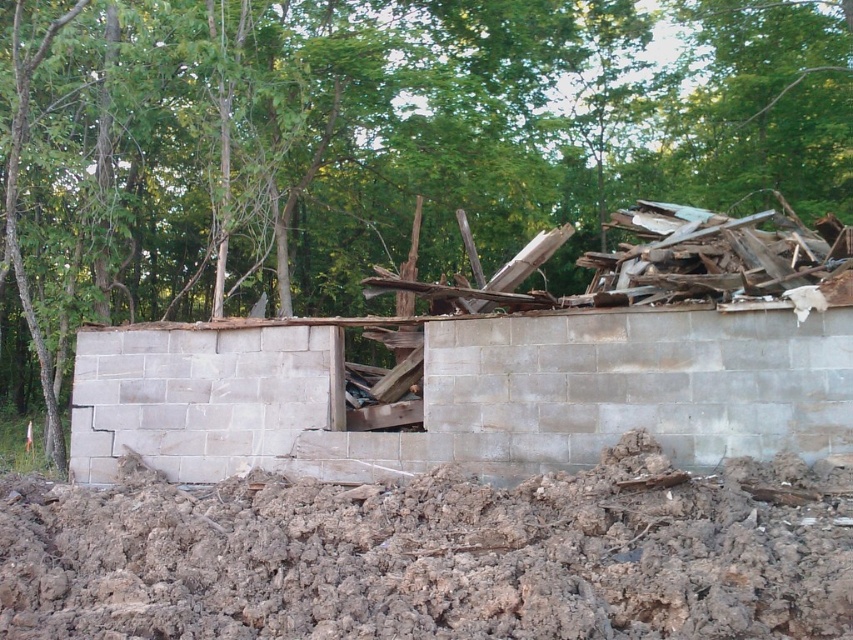
Between gray concrete wall at center and gray concrete block at center, which one is positioned higher?

gray concrete wall at center is higher up.

Can you confirm if gray concrete wall at center is smaller than gray concrete block at center?

Incorrect, gray concrete wall at center is not smaller in size than gray concrete block at center.

Between point (134, 449) and point (271, 380), which one is positioned in front?

Point (271, 380) is more forward.

Identify the location of gray concrete wall at center. (465, 392).

Who is higher up, green leafy tree at upper center or gray concrete wall at center?

green leafy tree at upper center

What do you see at coordinates (424, 230) in the screenshot? Image resolution: width=853 pixels, height=640 pixels. I see `green leafy tree at upper center` at bounding box center [424, 230].

Between point (206, 392) and point (444, 340), which one is positioned in front?

Point (444, 340)

You are a GUI agent. You are given a task and a screenshot of the screen. Output one action in this format:
    pyautogui.click(x=<x>, y=<y>)
    Task: Click on the green leafy tree at upper center
    This screenshot has width=853, height=640.
    Given the screenshot: What is the action you would take?
    pyautogui.click(x=424, y=230)

Is brown dirt at lower center above gray concrete block at center?

Actually, brown dirt at lower center is below gray concrete block at center.

Can you confirm if brown dirt at lower center is positioned to the left of gray concrete block at center?

Incorrect, brown dirt at lower center is not on the left side of gray concrete block at center.

What are the coordinates of `brown dirt at lower center` in the screenshot? It's located at (434, 556).

Find the location of a particular element. The image size is (853, 640). brown dirt at lower center is located at coordinates (434, 556).